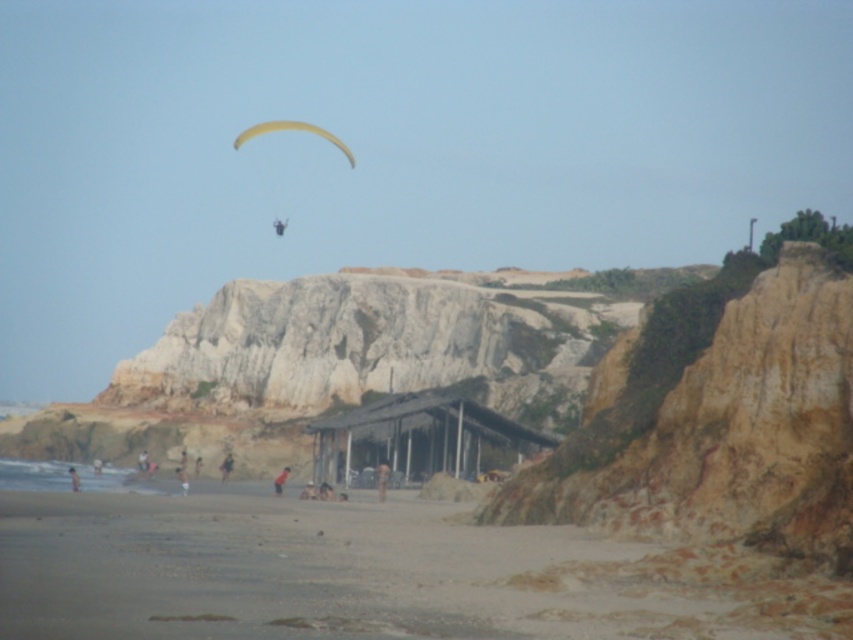
Question: Which point appears farthest from the camera in this image?

Choices:
 (A) (737, 554)
 (B) (221, 461)
 (C) (73, 484)
 (D) (384, 493)

Answer: (B)

Question: Which point appears farthest from the camera in this image?

Choices:
 (A) [251, 134]
 (B) [378, 474]
 (C) [225, 472]
 (D) [195, 605]

Answer: (A)

Question: Among these objects, which one is nearest to the camera?

Choices:
 (A) yellow fabric parachute at upper center
 (B) light brown sand at lower left

Answer: (B)

Question: Does light brown sand at center have a lesser width compared to light brown sand at lower left?

Choices:
 (A) yes
 (B) no

Answer: (A)

Question: Is light brown sand at lower center positioned behind smooth skin person at lower center?

Choices:
 (A) yes
 (B) no

Answer: (A)

Question: Can you confirm if smooth skin person at lower center is bigger than light brown sand at lower left?

Choices:
 (A) no
 (B) yes

Answer: (A)